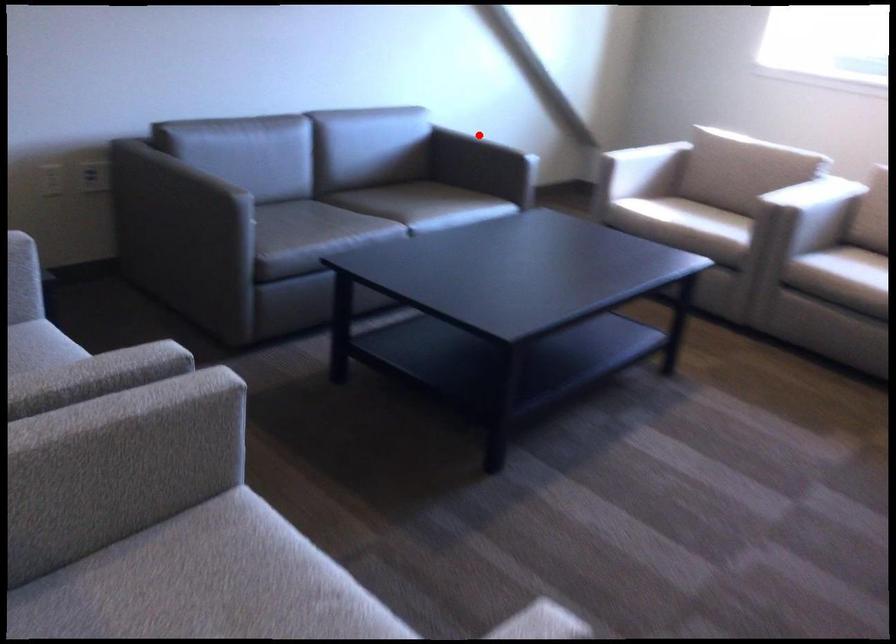
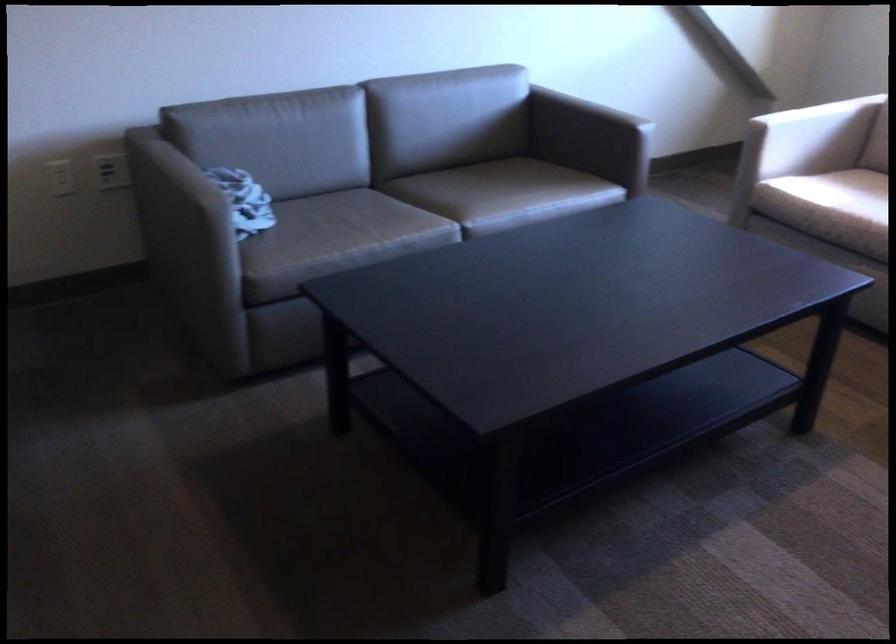
Locate, in the second image, the point that corresponds to the highlighted location in the first image.

(605, 93)